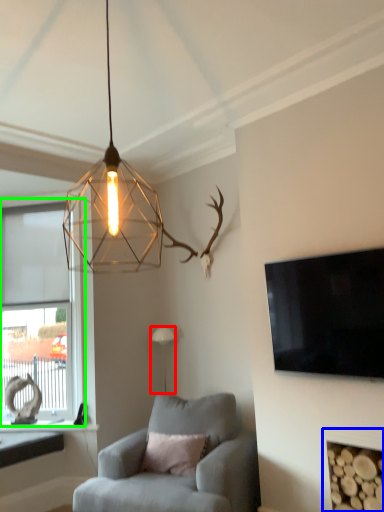
Question: Which object is the farthest from lamp (highlighted by a red box)? Choose among these: fireplace (highlighted by a blue box) or window (highlighted by a green box).

Choices:
 (A) fireplace
 (B) window

Answer: (A)